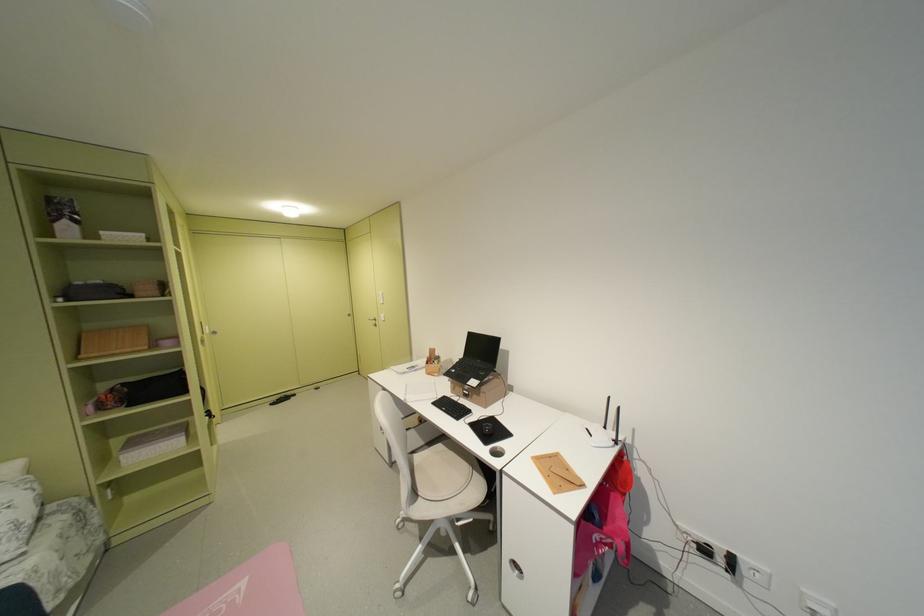
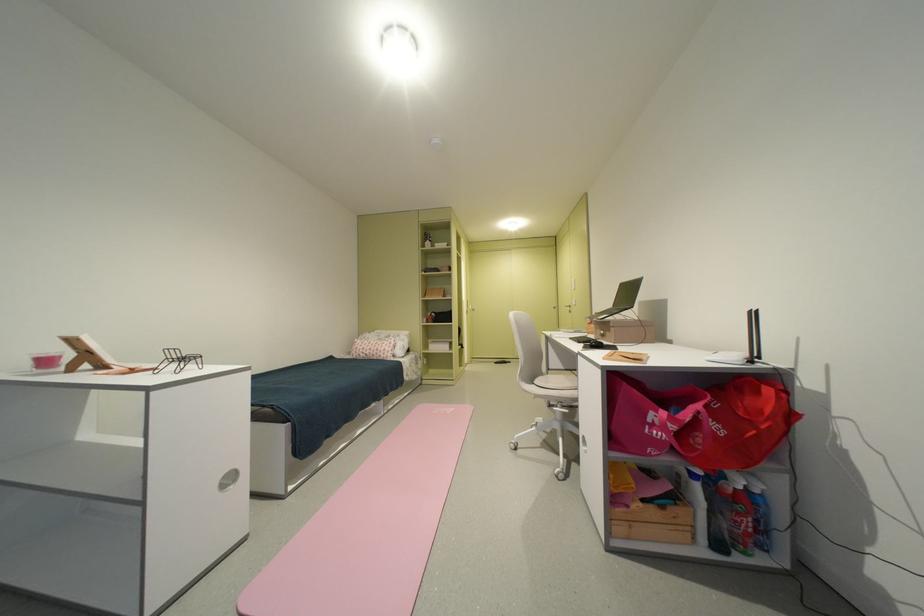
Where in the second image is the point corresponding to pixel 393 321 from the first image?

(584, 305)